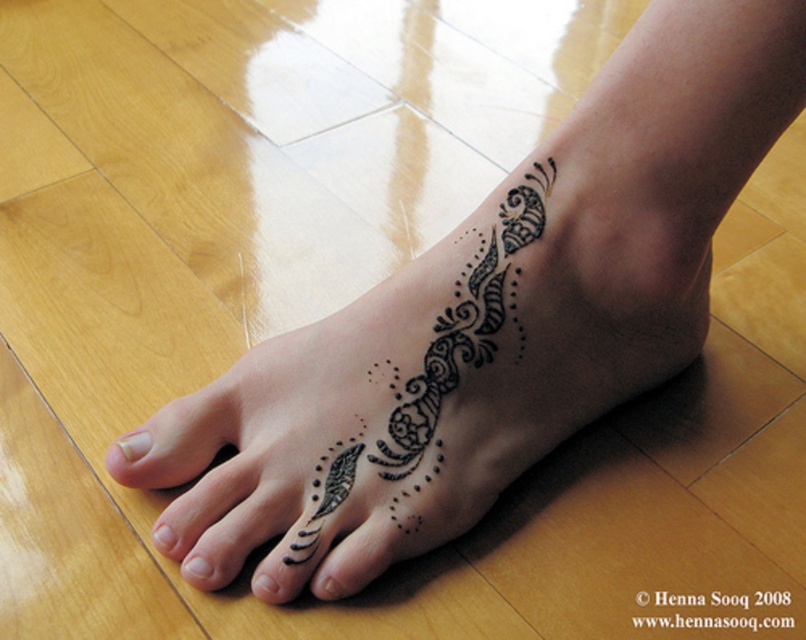
Question: Which object appears closest to the camera in this image?

Choices:
 (A) black matte nail at lower left
 (B) white matte nail at lower left

Answer: (A)

Question: Which of these objects is positioned farthest from the black ink dot at lower center?

Choices:
 (A) black ink toe at lower left
 (B) black ink tattoo at lower center
 (C) white matte nail at lower left
 (D) black matte nail at lower left

Answer: (B)

Question: Does black ink tattoo at lower center have a smaller size compared to black matte nail at lower left?

Choices:
 (A) no
 (B) yes

Answer: (A)

Question: Can you confirm if black ink tattoo at lower center is positioned below white matte nail at lower left?

Choices:
 (A) yes
 (B) no

Answer: (B)

Question: Among these objects, which one is farthest from the camera?

Choices:
 (A) black ink dot at lower center
 (B) black ink toe at lower left
 (C) white matte nail at lower left
 (D) black matte nail at lower left

Answer: (C)

Question: Does black ink toe at lower left appear on the right side of black matte nail at lower left?

Choices:
 (A) yes
 (B) no

Answer: (A)